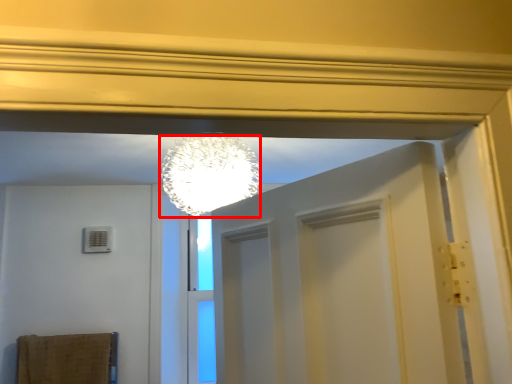
Question: From the image's perspective, what is the correct spatial relationship of lamp (annotated by the red box) in relation to bath towel?

Choices:
 (A) below
 (B) above

Answer: (B)